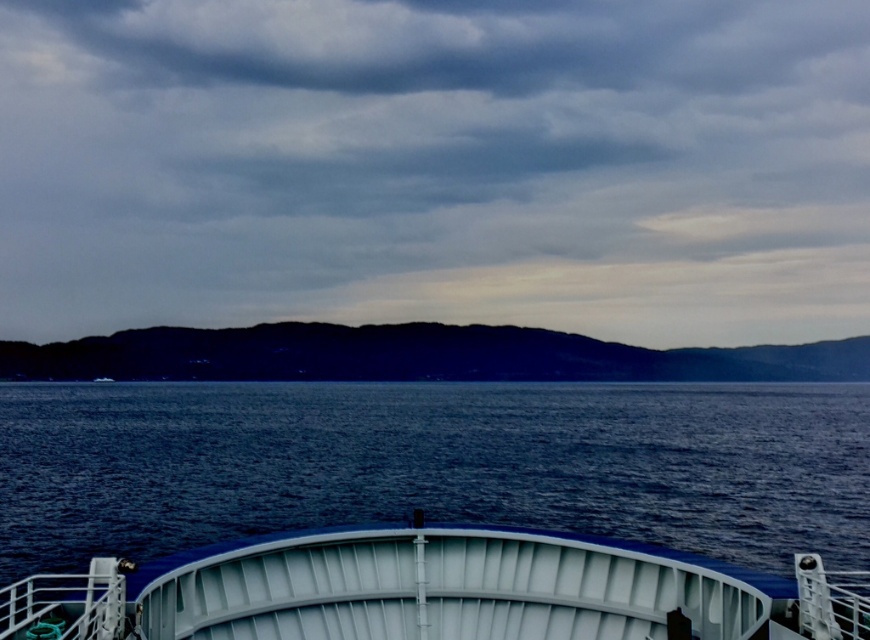
Question: Which object appears farthest from the camera in this image?

Choices:
 (A) white matte boat at center
 (B) blue water at center
 (C) gray matte cloud at upper center

Answer: (C)

Question: Can you confirm if blue water at center is positioned to the left of dark blue water at center?

Choices:
 (A) yes
 (B) no

Answer: (B)

Question: Among these objects, which one is nearest to the camera?

Choices:
 (A) blue water at center
 (B) dark blue water at center
 (C) white matte boat at center

Answer: (C)

Question: Considering the relative positions of blue water at center and white matte boat at center in the image provided, where is blue water at center located with respect to white matte boat at center?

Choices:
 (A) below
 (B) above

Answer: (A)

Question: Based on their relative distances, which object is nearer to the gray matte cloud at upper center?

Choices:
 (A) white matte boat at center
 (B) blue water at center

Answer: (B)

Question: Is the position of blue water at center more distant than that of white matte boat at center?

Choices:
 (A) no
 (B) yes

Answer: (B)